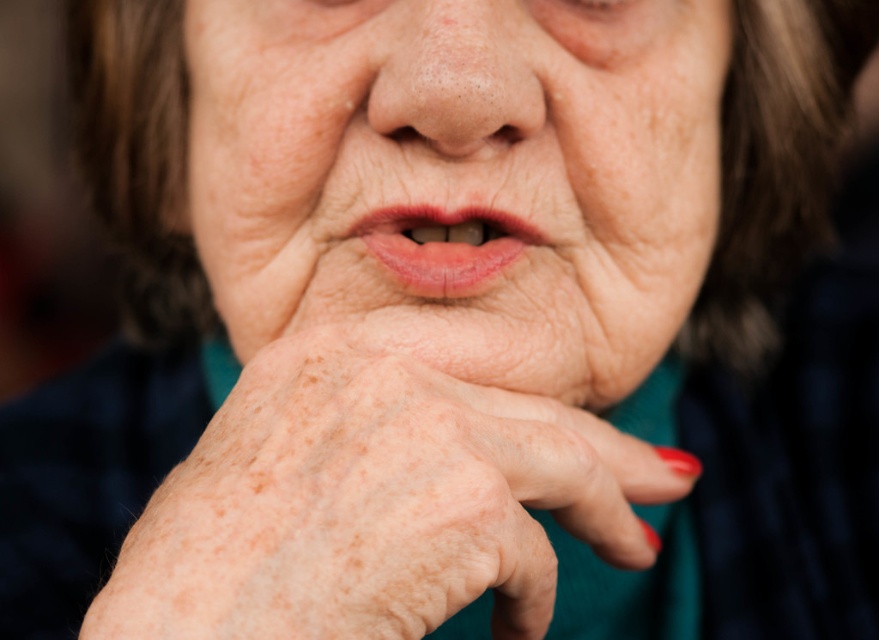
Question: Which of the following is the closest to the observer?

Choices:
 (A) pink glossy lips at center
 (B) dry skin wrinkle at center
 (C) dry skin nose at center
 (D) dry skin at center

Answer: (D)

Question: Does dry skin nose at center come in front of dry skin wrinkle at center?

Choices:
 (A) yes
 (B) no

Answer: (A)

Question: Considering the relative positions of dry skin at center and dry skin hand at center in the image provided, where is dry skin at center located with respect to dry skin hand at center?

Choices:
 (A) right
 (B) left

Answer: (A)

Question: Among these objects, which one is nearest to the camera?

Choices:
 (A) pink glossy lips at center
 (B) dry skin nose at center
 (C) dry skin hand at center
 (D) dry skin wrinkle at center

Answer: (C)

Question: Which object appears closest to the camera in this image?

Choices:
 (A) dry skin at center
 (B) pink glossy lips at center
 (C) dry skin wrinkle at center

Answer: (A)

Question: Does dry skin at center have a greater width compared to dry skin wrinkle at center?

Choices:
 (A) no
 (B) yes

Answer: (B)